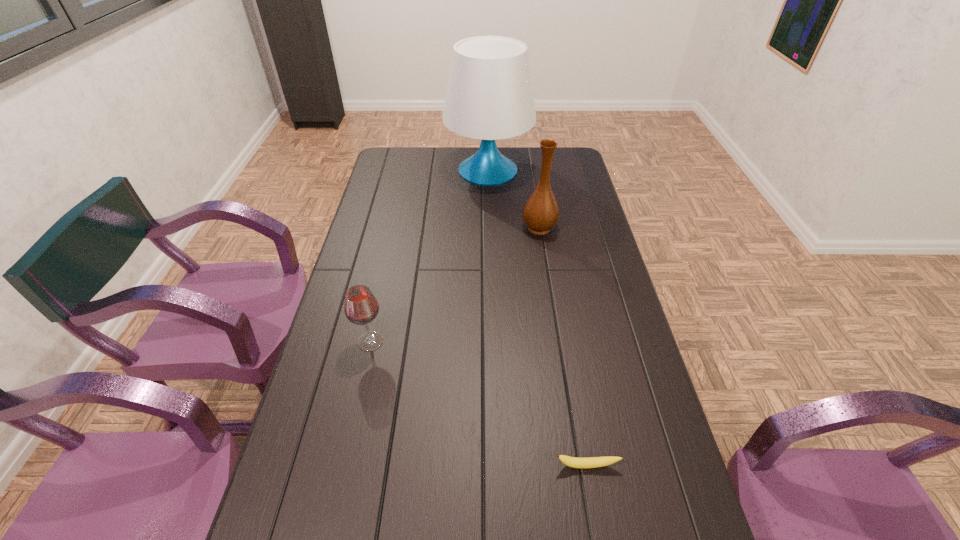
The width and height of the screenshot is (960, 540). I want to click on table lamp, so click(489, 96).

I want to click on the tallest object, so [x=489, y=96].

Where is `the third nearest object`? This screenshot has width=960, height=540. the third nearest object is located at coordinates (540, 213).

This screenshot has height=540, width=960. I want to click on the second tallest object, so click(x=540, y=213).

Locate an element on the screen. The height and width of the screenshot is (540, 960). the leftmost object is located at coordinates 361,307.

Where is `the second nearest object`? The width and height of the screenshot is (960, 540). the second nearest object is located at coordinates (361, 307).

Where is `banana`? banana is located at coordinates click(x=592, y=462).

The height and width of the screenshot is (540, 960). I want to click on the shortest object, so click(592, 462).

This screenshot has height=540, width=960. What are the coordinates of `free space located on the front-facing side of the tallest object` in the screenshot? It's located at (491, 235).

The image size is (960, 540). In order to click on vacant point located on the back of the third nearest object in this screenshot , I will do click(x=531, y=172).